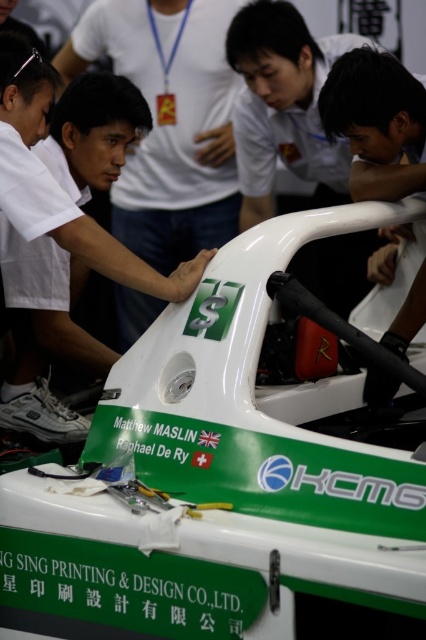
You are a photographer positioned behind the group of people examining the Formula car. You want to take a clear photo of the matte white shirt at center and the matte white helmet at center. Which object should you focus on first to ensure both are in focus?

You should focus on the matte white shirt at center first because it is closer to you than the matte white helmet at center, so adjusting focus from the closer object to the farther one will help both be in focus.

You are a photographer positioned to the side of the Formula car. You notice two white items at the center of your viewfinder. The first is a matte white shirt at center, and the second is a matte white helmet at center. Which item appears wider in your frame?

The matte white shirt at center appears wider in the frame because its width is larger than that of the matte white helmet at center.

You are a photographer positioned behind the matte white shirt at center and the matte white helmet at center. You want to capture a photo where both objects are in focus. Since you can only focus on one object, which one should you focus on to ensure the other is also in focus due to their relative positions?

You should focus on the matte white shirt at center because it is taller than the matte white helmet at center, so focusing on the taller object will keep both in focus.